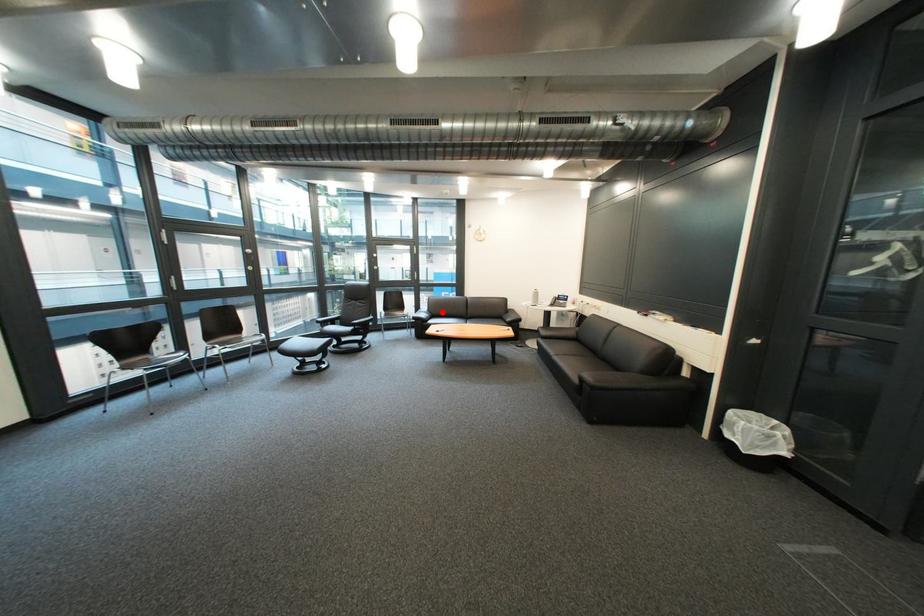
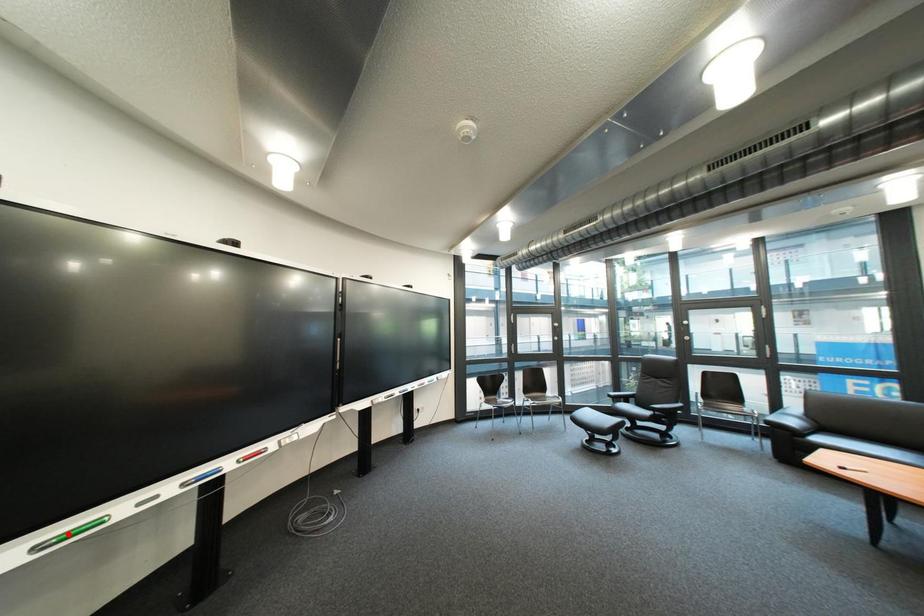
I am providing you with two images of the same scene from different viewpoints. A red point is marked on the first image and another point is marked on the second image. Does the point marked in image1 correspond to the same location as the one in image2?

No